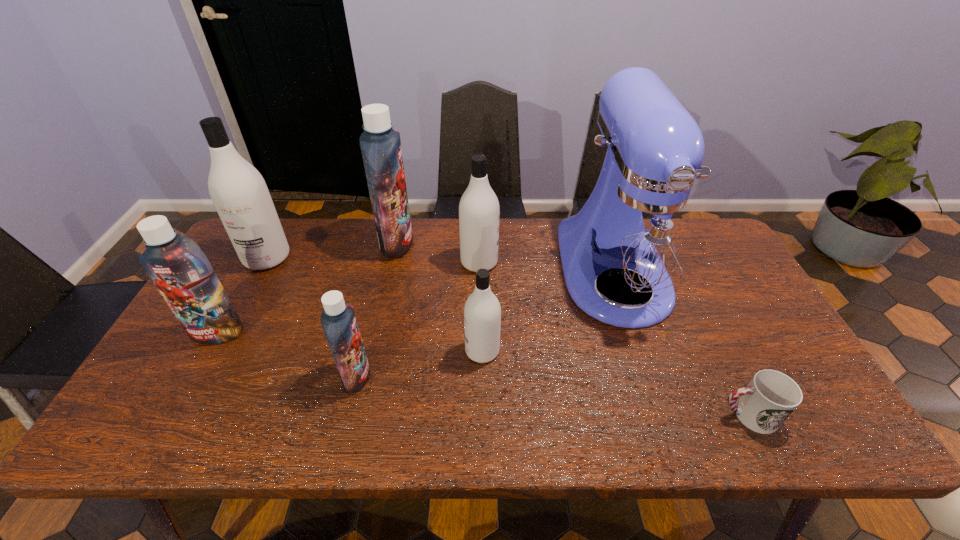
The image size is (960, 540). I want to click on vacant space situated on the side of the red cup where the handle is located, so click(x=542, y=415).

The height and width of the screenshot is (540, 960). What are the coordinates of `vacant space positioned 0.230m on the side of the red cup where the handle is located` in the screenshot? It's located at coord(617,415).

At what (x,y) coordinates should I click in order to perform the action: click on free region located 0.210m on the side of the red cup where the handle is located. Please return your answer as a coordinate pair (x, y). Image resolution: width=960 pixels, height=540 pixels. Looking at the image, I should click on (626, 415).

Image resolution: width=960 pixels, height=540 pixels. I want to click on mixer located in the far edge section of the desktop, so click(640, 233).

What are the coordinates of `object present at the near edge` in the screenshot? It's located at (771, 396).

Locate an element on the screen. The height and width of the screenshot is (540, 960). object that is at the right edge is located at coordinates (771, 396).

Where is `object situated at the far left corner`? This screenshot has width=960, height=540. object situated at the far left corner is located at coordinates (239, 193).

Locate an element on the screen. The width and height of the screenshot is (960, 540). object that is at the near right corner is located at coordinates (771, 396).

Locate an element on the screen. Image resolution: width=960 pixels, height=540 pixels. vacant space at the far edge of the desktop is located at coordinates pos(541,257).

Locate an element on the screen. The image size is (960, 540). vacant space at the near edge of the desktop is located at coordinates (542, 412).